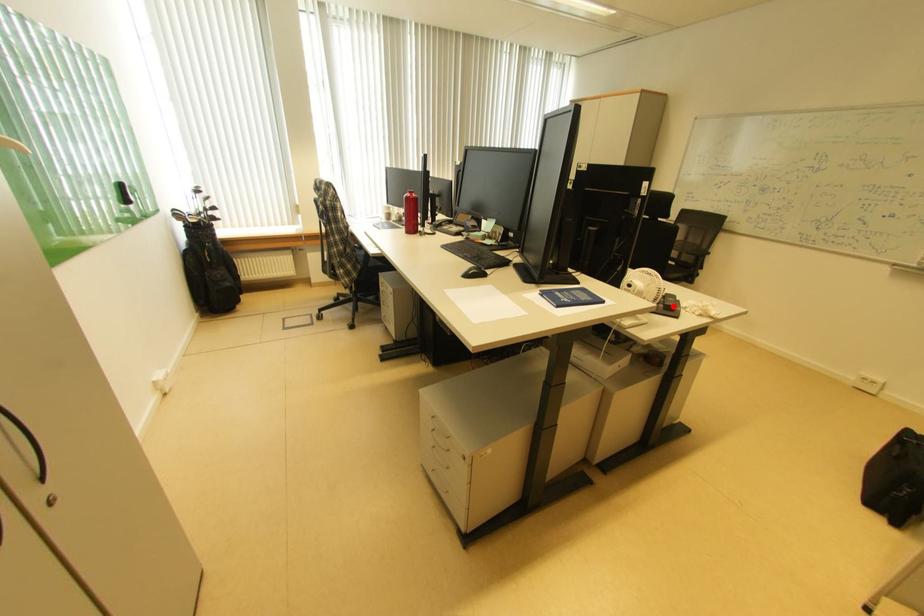
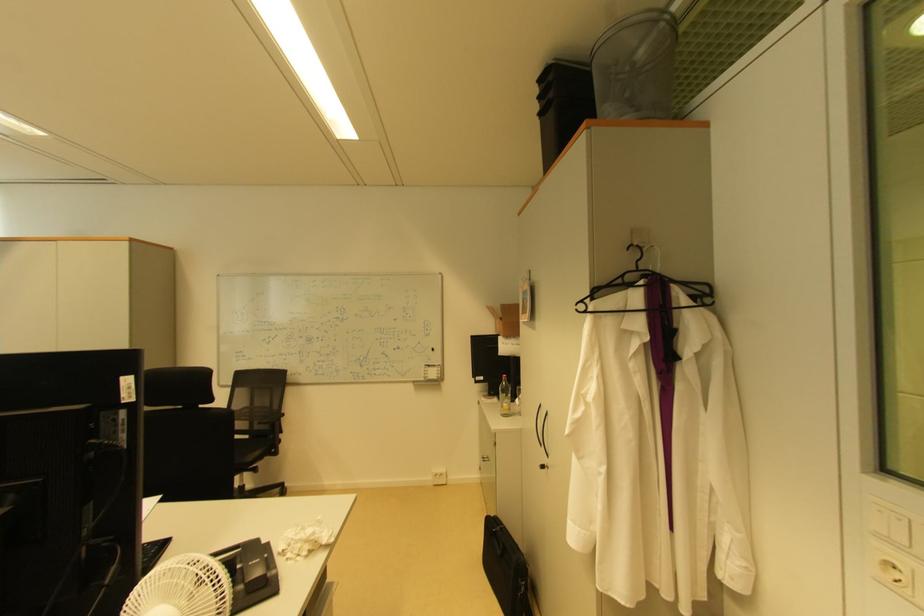
Question: A red point is marked in image1. In image2, is the corresponding 3D point closer to the camera or farther? Reply with the corresponding letter.

Choices:
 (A) The corresponding 3D point is closer.
 (B) The corresponding 3D point is farther.

Answer: (A)